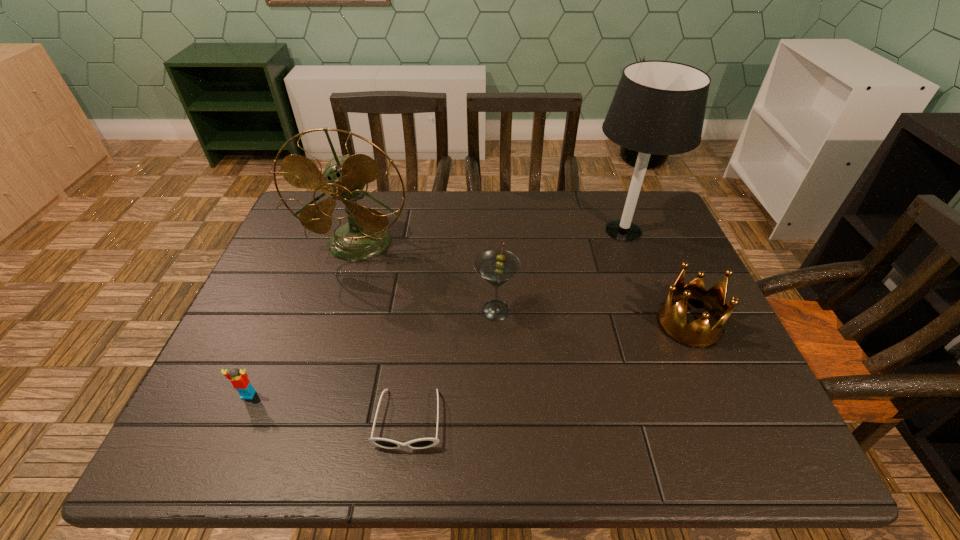
Locate an element on the screen. table lamp is located at coordinates (658, 108).

Locate an element on the screen. fan is located at coordinates (366, 235).

Locate an element on the screen. martini is located at coordinates (497, 266).

Identify the location of the third tallest object. The height and width of the screenshot is (540, 960). (497, 266).

Locate an element on the screen. This screenshot has width=960, height=540. crown is located at coordinates coord(698,334).

Identify the location of the second shortest object. The height and width of the screenshot is (540, 960). (239, 379).

The image size is (960, 540). What are the coordinates of `sunglasses` in the screenshot? It's located at (422, 443).

The height and width of the screenshot is (540, 960). I want to click on vacant space located 0.350m on the left of the tallest object, so click(464, 231).

Find the location of a particular element. vacant space located 0.170m in front of the fan, directing air flow is located at coordinates (337, 314).

Identify the location of free space located 0.280m on the front of the third object from right to left. Image resolution: width=960 pixels, height=540 pixels. (500, 443).